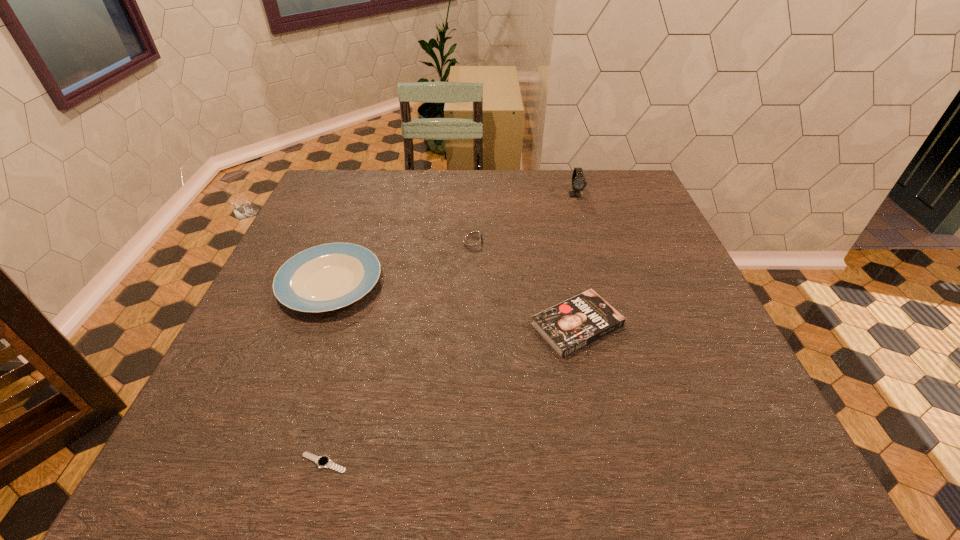
The height and width of the screenshot is (540, 960). I want to click on empty location between the farthest object and the book, so click(576, 260).

Locate an element on the screen. The height and width of the screenshot is (540, 960). free space between the book and the third object from left to right is located at coordinates (525, 283).

Find the location of a particular element. The height and width of the screenshot is (540, 960). object that can be found as the closest to the leftmost watch is located at coordinates (326, 277).

Locate which object is the second closest to the plate. Please provide its 2D coordinates. Your answer should be formatted as a tuple, i.e. [(x, y)], where the tuple contains the x and y coordinates of a point satisfying the conditions above.

[(322, 461)]

Identify the location of watch identified as the closest to the shortest object. The image size is (960, 540). (473, 240).

Select which watch is the closest to the rightmost watch. Please provide its 2D coordinates. Your answer should be formatted as a tuple, i.e. [(x, y)], where the tuple contains the x and y coordinates of a point satisfying the conditions above.

[(473, 240)]

Find the location of a particular element. Image resolution: width=960 pixels, height=540 pixels. vacant space that satisfies the following two spatial constraints: 1. on the face of the second shortest watch; 2. on the front side of the nearest object is located at coordinates (469, 463).

Identify the location of free spot that satisfies the following two spatial constraints: 1. on the face of the tallest watch; 2. on the face of the second watch from right to left. This screenshot has height=540, width=960. (589, 240).

What are the coordinates of `blank space that satisfies the following two spatial constraints: 1. on the face of the book; 2. on the left side of the third object from right to left` in the screenshot? It's located at (472, 325).

Where is `free location that satisfies the following two spatial constraints: 1. on the front side of the leftmost watch; 2. on the right side of the plate`? The image size is (960, 540). free location that satisfies the following two spatial constraints: 1. on the front side of the leftmost watch; 2. on the right side of the plate is located at coordinates (264, 463).